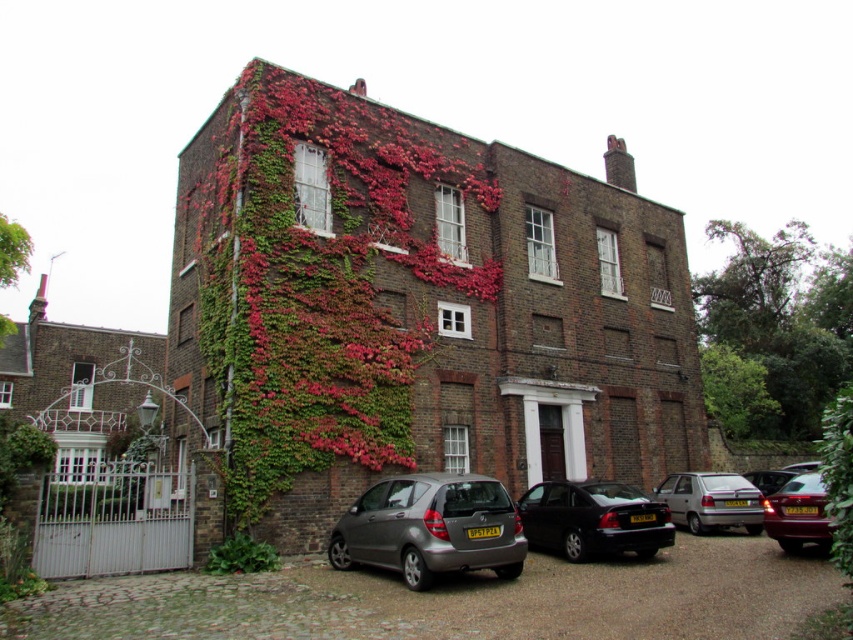
You are a delivery driver who needs to back out of the driveway. You see two silver metallic cars in your view. Which silver metallic car is positioned higher up the driveway, the silver metallic car at lower right or the metallic silver car at center?

The silver metallic car at lower right is located above the metallic silver car at center, so it is positioned higher up the driveway.

You are a delivery person trying to park your van between the satin grey car at lower center and the silver metallic car at lower right. Your van is 6 meters long. Is there enough space between them?

The distance between the satin grey car at lower center and the silver metallic car at lower right is 19.78 meters. Since your van is only 6 meters long, there is more than enough space to park between them.

You are standing at the entrance of the three story brick building and want to hail the shiny maroon sedan at right. Which direction should you walk to reach it?

You should walk towards the right side of the driveway to reach the shiny maroon sedan at right.